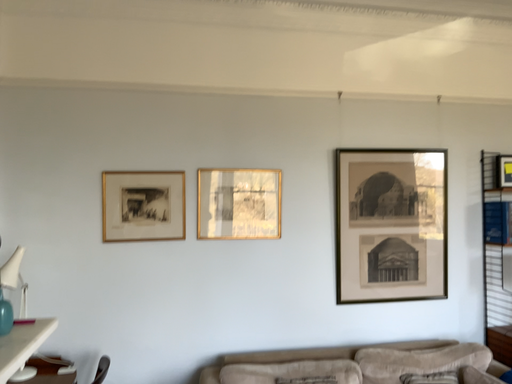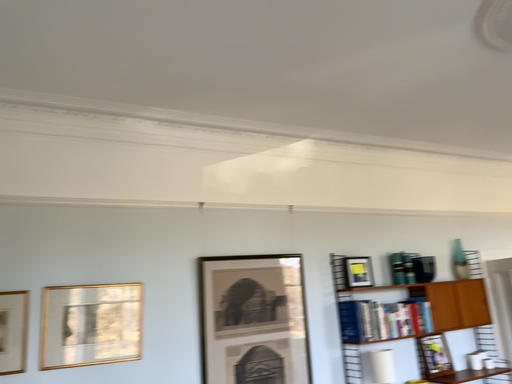
Question: Which way did the camera rotate in the video?

Choices:
 (A) rotated downward
 (B) rotated upward

Answer: (B)